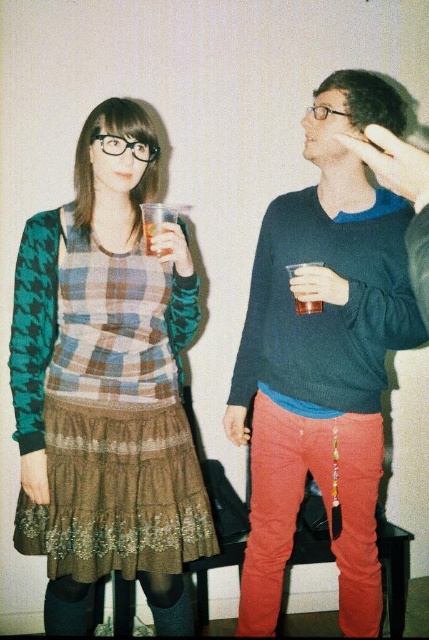
Between matte blue sweater at center and translucent plastic cup at right, which one is positioned lower?

matte blue sweater at center is lower down.

Can you confirm if matte blue sweater at center is positioned to the right of translucent plastic cup at right?

Indeed, matte blue sweater at center is positioned on the right side of translucent plastic cup at right.

Locate an element on the screen. matte blue sweater at center is located at coordinates (323, 355).

The height and width of the screenshot is (640, 429). In order to click on matte blue sweater at center in this screenshot , I will do `click(323, 355)`.

Locate an element on the screen. This screenshot has height=640, width=429. matte blue sweater at center is located at coordinates (323, 355).

Locate an element on the screen. matte blue sweater at center is located at coordinates (323, 355).

Which is more to the right, translucent plastic cup at center or translucent plastic cup at right?

Positioned to the right is translucent plastic cup at right.

Does translucent plastic cup at center have a greater height compared to translucent plastic cup at right?

No.

Describe the element at coordinates (154, 236) in the screenshot. This screenshot has width=429, height=640. I see `translucent plastic cup at center` at that location.

Identify the location of translucent plastic cup at center. (154, 236).